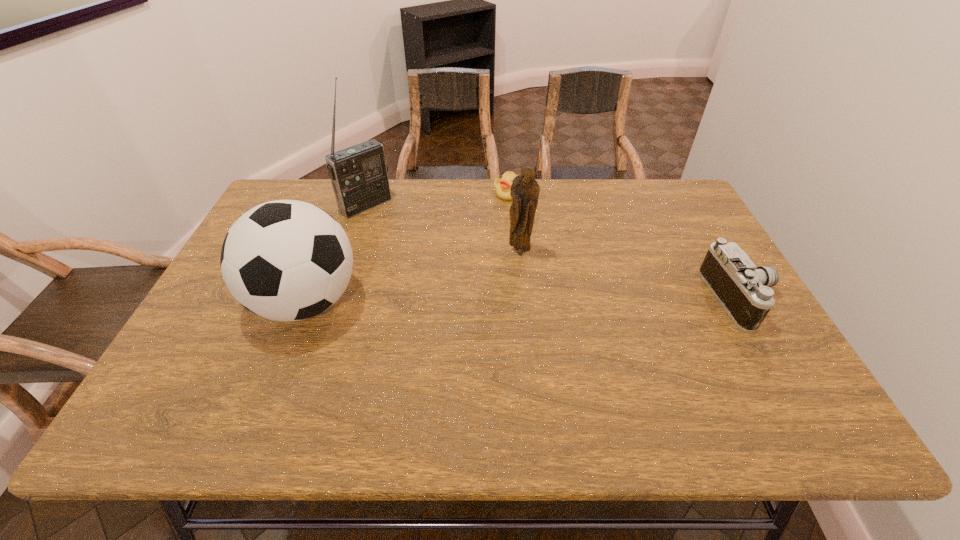
Identify the location of free space located at the face of the duckling. Image resolution: width=960 pixels, height=540 pixels. (483, 252).

The image size is (960, 540). In order to click on vacant area situated 0.050m at the face of the duckling in this screenshot , I will do (501, 210).

Identify the location of vacant space located 0.350m at the face of the duckling. This screenshot has width=960, height=540. (473, 273).

This screenshot has height=540, width=960. Identify the location of vacant region located 0.270m on the display of the tallest object. (430, 259).

Identify the location of vacant space located 0.300m on the display of the tallest object. The image size is (960, 540). (437, 264).

The height and width of the screenshot is (540, 960). What are the coordinates of `vacant space located on the display of the tallest object` in the screenshot? It's located at (416, 247).

This screenshot has height=540, width=960. I want to click on duckling that is at the far edge, so click(502, 186).

Find the location of a particular element. The height and width of the screenshot is (540, 960). radio receiver at the far edge is located at coordinates (358, 174).

Where is `object located in the left edge section of the desktop`? object located in the left edge section of the desktop is located at coordinates (285, 260).

Where is `object located at the right edge`? object located at the right edge is located at coordinates (743, 290).